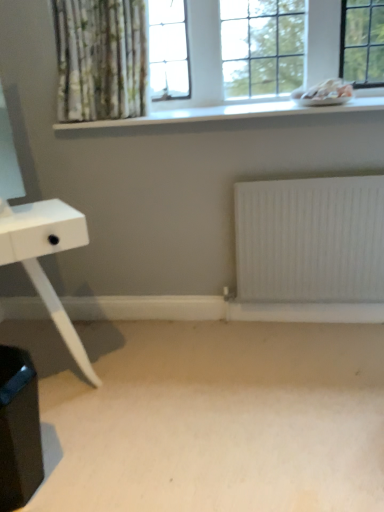
The width and height of the screenshot is (384, 512). In order to click on free space in front of white matte radiator at lower center in this screenshot , I will do `click(314, 366)`.